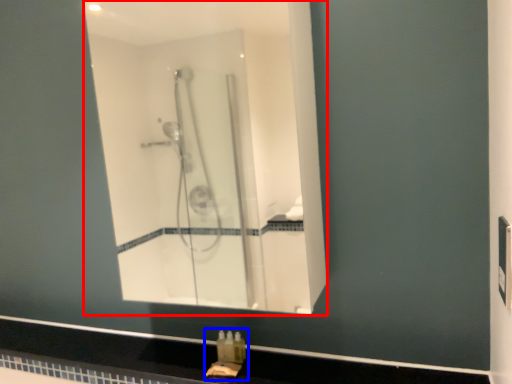
Question: Which of the following is the closest to the observer, mirror (highlighted by a red box) or sink (highlighted by a blue box)?

Choices:
 (A) mirror
 (B) sink

Answer: (A)